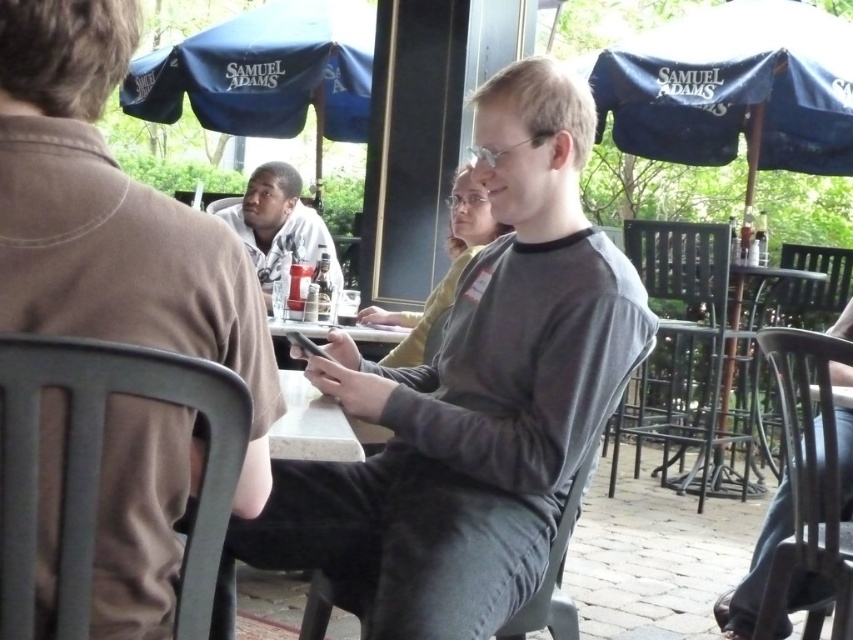
Question: Can you confirm if gray matte shirt at center is smaller than jeans at lower right?

Choices:
 (A) no
 (B) yes

Answer: (A)

Question: Which of the following is the closest to the observer?

Choices:
 (A) (587, 390)
 (B) (292, 113)
 (C) (682, 452)

Answer: (A)

Question: Among these points, which one is farthest from the camera?

Choices:
 (A) (828, 332)
 (B) (273, 332)
 (C) (289, 236)

Answer: (C)

Question: Does gray fabric shirt at center have a lesser width compared to blue fabric umbrella at upper center?

Choices:
 (A) yes
 (B) no

Answer: (A)

Question: Is gray matte shirt at center smaller than gray fabric shirt at center?

Choices:
 (A) no
 (B) yes

Answer: (A)

Question: Which point is farther from the camera taking this photo?

Choices:
 (A) (776, 538)
 (B) (393, 326)
 (C) (792, 288)
 (D) (270, 256)

Answer: (C)